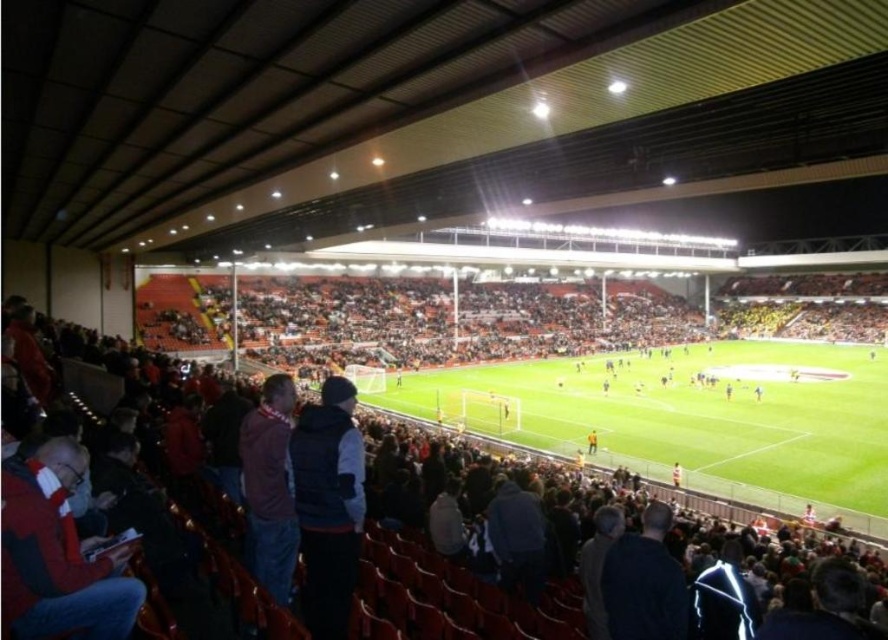
Question: Among these points, which one is farthest from the camera?

Choices:
 (A) (266, 472)
 (B) (373, 531)

Answer: (B)

Question: Which object is closer to the camera taking this photo?

Choices:
 (A) green grass football field at center
 (B) dark red sweater at lower left
 (C) dark blue vest at center

Answer: (C)

Question: Can you confirm if dark red seats at center is bigger than red fleece scarf at lower left?

Choices:
 (A) no
 (B) yes

Answer: (B)

Question: Which is nearer to the dark red sweater at lower left?

Choices:
 (A) dark blue vest at center
 (B) dark red seats at center
 (C) green grass football field at center
 (D) red fleece scarf at lower left

Answer: (A)

Question: Is green grass football field at center positioned at the back of dark red sweater at lower left?

Choices:
 (A) no
 (B) yes

Answer: (B)

Question: Can you confirm if red fleece scarf at lower left is positioned above dark red sweater at lower left?

Choices:
 (A) no
 (B) yes

Answer: (B)